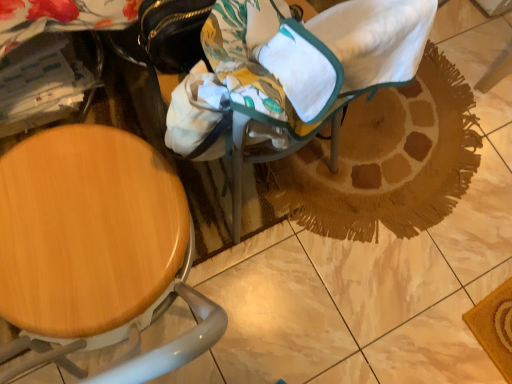
Question: In the image, is wooden seat at left positioned in front of or behind canvas fabric baby carriage at center?

Choices:
 (A) front
 (B) behind

Answer: (A)

Question: Considering the positions of wooden seat at left and canvas fabric baby carriage at center in the image, is wooden seat at left wider or thinner than canvas fabric baby carriage at center?

Choices:
 (A) thin
 (B) wide

Answer: (B)

Question: Estimate the real-world distances between objects in this image. Which object is closer to the wooden seat at left?

Choices:
 (A) canvas fabric baby carriage at center
 (B) brown woven mat at center

Answer: (A)

Question: Which of these objects is positioned closest to the brown woven mat at center?

Choices:
 (A) wooden seat at left
 (B) canvas fabric baby carriage at center

Answer: (B)